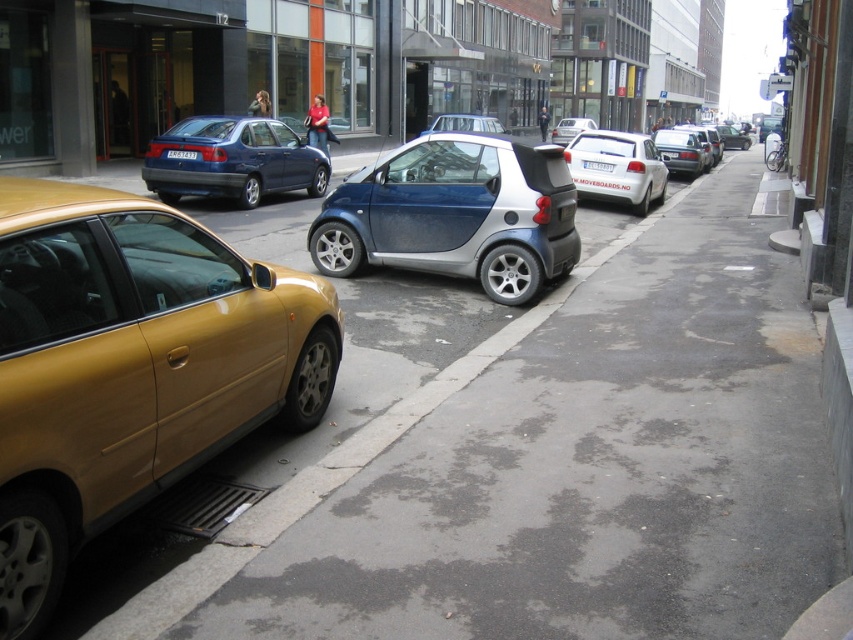
You are a delivery driver trying to navigate through the street shown in the image. There is a point marked at coordinates (233, 161). What object is located at that point?

The point at coordinates (233, 161) corresponds to the matte blue sedan at center.

You are a delivery person needing to park your 5.5 meter long van between the metallic blue car at center and the matte blue sedan at center. Can your van fit in the space between them?

The metallic blue car at center is 6.48 meters from the matte blue sedan at center. Since your van is 5.5 meters long, it can fit in the space between them as there is enough distance.